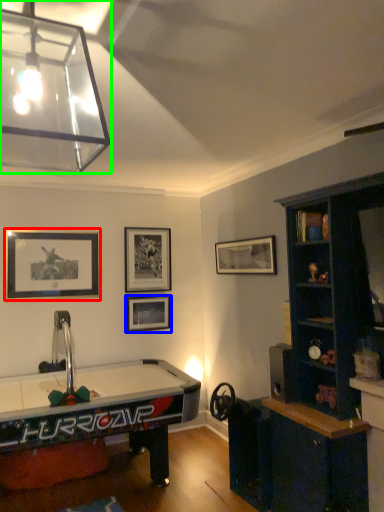
Question: Based on their relative distances, which object is nearer to picture frame (highlighted by a red box)? Choose from picture frame (highlighted by a blue box) and lamp (highlighted by a green box).

Choices:
 (A) picture frame
 (B) lamp

Answer: (A)